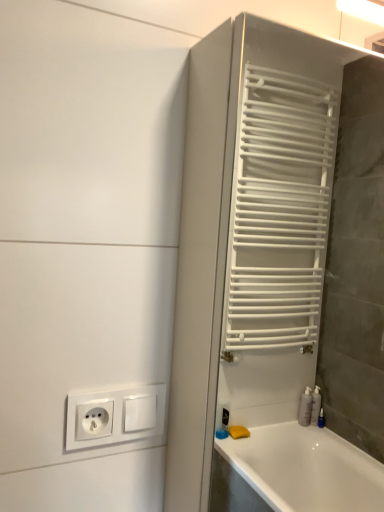
This screenshot has width=384, height=512. Describe the element at coordinates (114, 416) in the screenshot. I see `white plastic socket at lower left` at that location.

Measure the distance between white plastic socket at lower left and camera.

white plastic socket at lower left is 24.91 inches from camera.

I want to click on white plastic socket at lower left, so click(x=114, y=416).

What is the approximate width of white matte towel rack at right?

The width of white matte towel rack at right is 5.64 inches.

What do you see at coordinates (278, 279) in the screenshot? Image resolution: width=384 pixels, height=512 pixels. I see `white matte towel rack at right` at bounding box center [278, 279].

Image resolution: width=384 pixels, height=512 pixels. I want to click on white matte towel rack at right, so click(x=278, y=279).

Where is `white plastic socket at lower left`? The width and height of the screenshot is (384, 512). white plastic socket at lower left is located at coordinates (114, 416).

Can you confirm if white plastic socket at lower left is positioned to the right of white matte towel rack at right?

No.

Does white plastic socket at lower left lie behind white matte towel rack at right?

That is True.

Considering the points (141, 430) and (342, 500), which point is in front, point (141, 430) or point (342, 500)?

The point (141, 430) is in front.

From the image's perspective, is white plastic socket at lower left over white matte towel rack at right?

No, from the image's perspective, white plastic socket at lower left is not on top of white matte towel rack at right.

From a real-world perspective, relative to white matte towel rack at right, is white plastic socket at lower left vertically above or below?

white plastic socket at lower left is situated lower than white matte towel rack at right in the real world.

Can you confirm if white plastic socket at lower left is thinner than white matte towel rack at right?

Yes, white plastic socket at lower left is thinner than white matte towel rack at right.

Between white plastic socket at lower left and white matte towel rack at right, which one has less height?

Standing shorter between the two is white plastic socket at lower left.

Based on their sizes in the image, would you say white plastic socket at lower left is bigger or smaller than white matte towel rack at right?

Clearly, white plastic socket at lower left is smaller in size than white matte towel rack at right.

Is white plastic socket at lower left outside of white matte towel rack at right?

Yes, white plastic socket at lower left is outside of white matte towel rack at right.

Based on the photo, are white plastic socket at lower left and white matte towel rack at right located far from each other?

Yes, white plastic socket at lower left and white matte towel rack at right are quite far apart.

Is white plastic socket at lower left aimed at white matte towel rack at right?

No.

Can you tell me how much white plastic socket at lower left and white matte towel rack at right differ in facing direction?

They differ by 0.0574 degrees in their facing directions.

The width and height of the screenshot is (384, 512). Find the location of `screen door that is above the white plastic socket at lower left (from the image's perspective)`. screen door that is above the white plastic socket at lower left (from the image's perspective) is located at coordinates (278, 279).

Which is more to the left, white matte towel rack at right or white plastic socket at lower left?

From the viewer's perspective, white plastic socket at lower left appears more on the left side.

Which object is more forward, white matte towel rack at right or white plastic socket at lower left?

Positioned in front is white matte towel rack at right.

Considering the points (367, 79) and (72, 402), which point is behind, point (367, 79) or point (72, 402)?

Point (367, 79)

From the image's perspective, which object appears higher, white matte towel rack at right or white plastic socket at lower left?

white matte towel rack at right.

From a real-world perspective, between white matte towel rack at right and white plastic socket at lower left, who is vertically higher?

white matte towel rack at right, from a real-world perspective.

Considering the relative sizes of white matte towel rack at right and white plastic socket at lower left in the image provided, is white matte towel rack at right thinner than white plastic socket at lower left?

No, white matte towel rack at right is not thinner than white plastic socket at lower left.

Considering the sizes of white matte towel rack at right and white plastic socket at lower left in the image, is white matte towel rack at right taller or shorter than white plastic socket at lower left?

Clearly, white matte towel rack at right is taller compared to white plastic socket at lower left.

Is white matte towel rack at right bigger or smaller than white plastic socket at lower left?

Considering their sizes, white matte towel rack at right takes up more space than white plastic socket at lower left.

Would you say white matte towel rack at right is inside or outside white plastic socket at lower left?

white matte towel rack at right lies outside white plastic socket at lower left.

Is white matte towel rack at right far away from white plastic socket at lower left?

white matte towel rack at right is far away from white plastic socket at lower left.

Is white matte towel rack at right oriented towards white plastic socket at lower left?

No, white matte towel rack at right does not turn towards white plastic socket at lower left.

Locate an element on the screen. Image resolution: width=384 pixels, height=512 pixels. power plugs and sockets below the white matte towel rack at right (from the image's perspective) is located at coordinates (114, 416).

Locate an element on the screen. The image size is (384, 512). screen door in front of the white plastic socket at lower left is located at coordinates (278, 279).

This screenshot has height=512, width=384. Find the location of `screen door above the white plastic socket at lower left (from a real-world perspective)`. screen door above the white plastic socket at lower left (from a real-world perspective) is located at coordinates (278, 279).